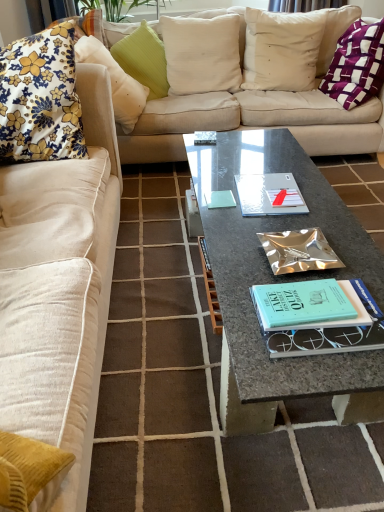
You are a GUI agent. You are given a task and a screenshot of the screen. Output one action in this format:
    pyautogui.click(x=<x>, y=<y>)
    Task: Click on the free spot to the left of silver metallic notebook at center
    This screenshot has width=384, height=512.
    Given the screenshot: What is the action you would take?
    pyautogui.click(x=216, y=195)